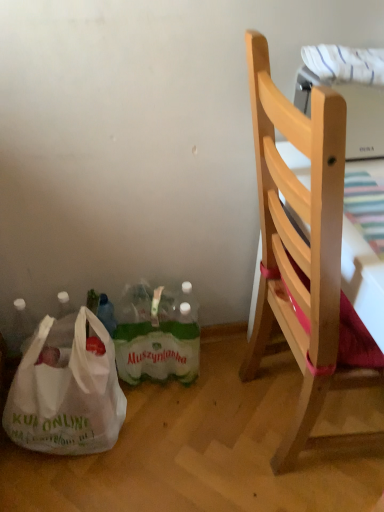
At what (x,y) coordinates should I click in order to perform the action: click on vacant space that's between natural wood chair at right and green plastic bottles at lower center. Please return your answer as a coordinate pair (x, y). The image size is (384, 512). Looking at the image, I should click on (198, 407).